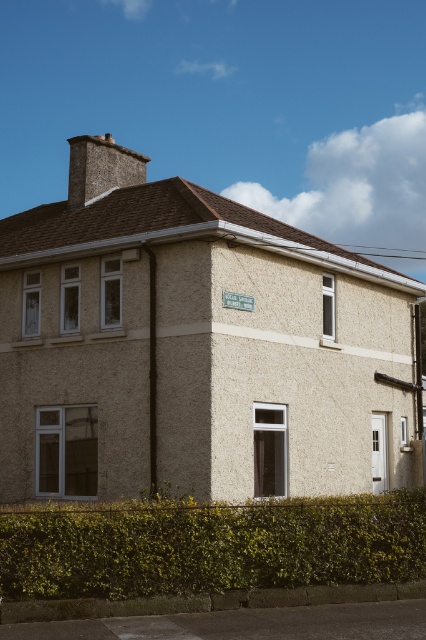
Question: Which object appears closest to the camera in this image?

Choices:
 (A) green plastic street sign at upper center
 (B) green leafy hedge at lower center

Answer: (B)

Question: Does green leafy hedge at lower center appear under green plastic street sign at upper center?

Choices:
 (A) yes
 (B) no

Answer: (A)

Question: Is green leafy hedge at lower center wider than green plastic street sign at upper center?

Choices:
 (A) no
 (B) yes

Answer: (B)

Question: Which point is farther from the camera taking this photo?

Choices:
 (A) (244, 298)
 (B) (86, 525)

Answer: (A)

Question: Does green leafy hedge at lower center appear under green plastic street sign at upper center?

Choices:
 (A) no
 (B) yes

Answer: (B)

Question: Among these objects, which one is farthest from the camera?

Choices:
 (A) green leafy hedge at lower center
 (B) green plastic street sign at upper center

Answer: (B)